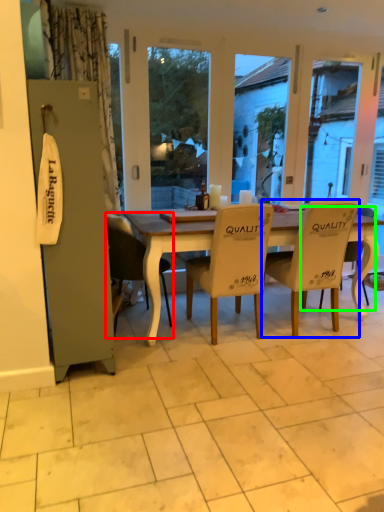
Question: Estimate the real-world distances between objects in this image. Which object is farther from chair (highlighted by a red box), chair (highlighted by a blue box) or chair (highlighted by a green box)?

Choices:
 (A) chair
 (B) chair

Answer: (B)